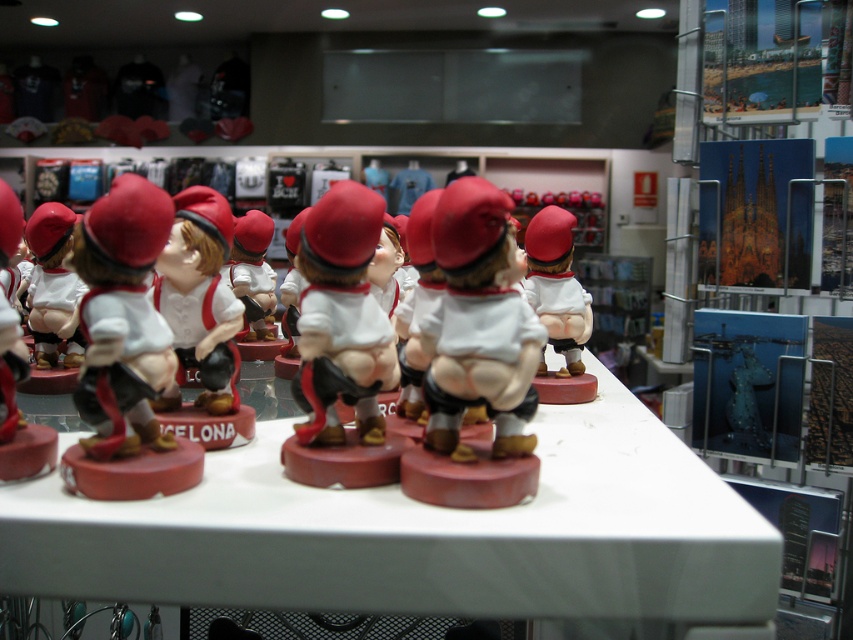
You are a customer in the souvenir shop and want to place the matte white figurine at center on the white glossy table at center. Based on their sizes, will the figurine fit on the table?

The white glossy table at center has a larger size compared to matte white figurine at center, so the figurine will fit on the table.

From the picture: You are a customer in the souvenir shop and want to pick up the matte white figurine at center. Can you reach it from where you are standing in front of the white glossy table at center?

The white glossy table at center is closer to the viewer than the matte white figurine at center, so you cannot reach the matte white figurine at center from your current position in front of the white glossy table at center.